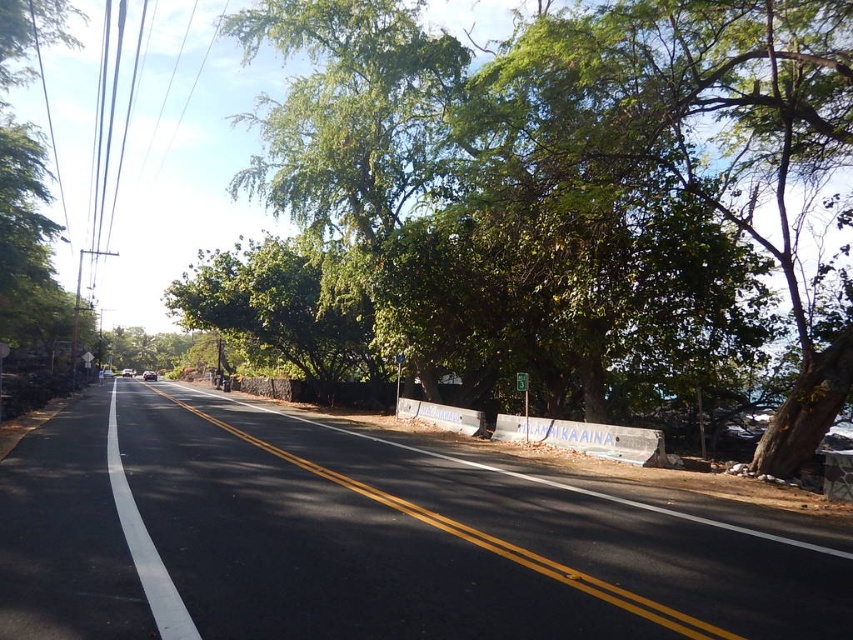
You are a driver approaching the green leafy tree at center and the white asphalt road at center. Which object will appear larger in your view as you get closer?

The green leafy tree at center will appear larger in your view as you get closer because it is bigger than the white asphalt road at center.

You are a delivery drone flying above a road. You need to deliver a package to a location marked by the green leafy tree at center. According to the road markings, where should you position yourself to ensure safe delivery?

The green leafy tree at center is located at point (852, 639). To ensure safe delivery, the drone should position itself above the road while avoiding the double yellow line and staying within the designated driving lanes, as the tree is centrally located.

Based on the photo, you are standing at the point with coordinates (492, 541) on the image. Based on the scene description, what surface are you standing on?

The point at coordinates (492, 541) corresponds to the black asphalt road at center, so you are standing on the asphalt road.